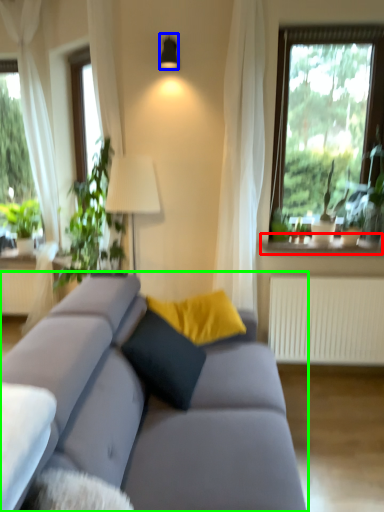
Question: Which object is positioned farthest from window sill (highlighted by a red box)? Select from lamp (highlighted by a blue box) and studio couch (highlighted by a green box).

Choices:
 (A) lamp
 (B) studio couch

Answer: (A)